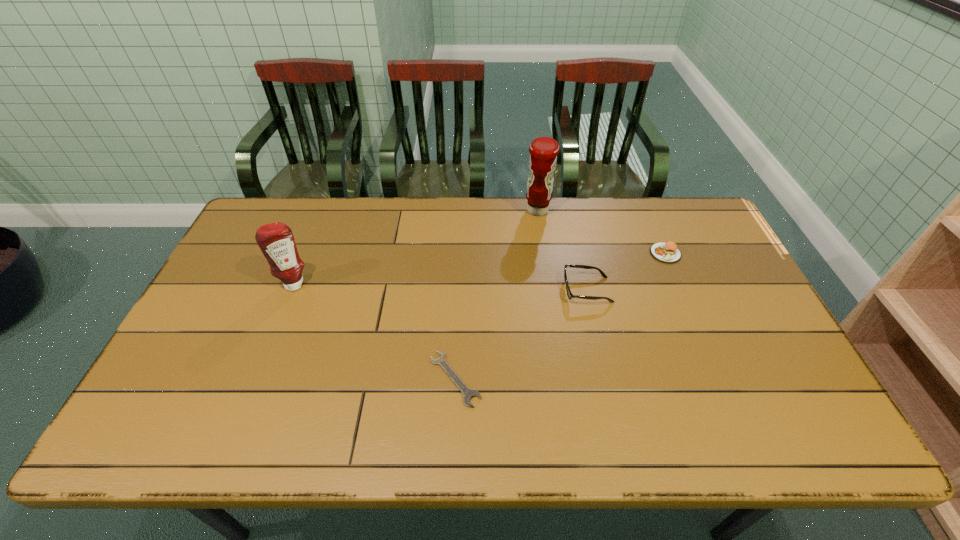
Where is `the farther condiment`? Image resolution: width=960 pixels, height=540 pixels. the farther condiment is located at coordinates (543, 151).

Where is `the tallest object`? The height and width of the screenshot is (540, 960). the tallest object is located at coordinates (543, 151).

The image size is (960, 540). In order to click on the shorter condiment in this screenshot , I will do click(x=276, y=241).

Find the location of a particular element. the nearer condiment is located at coordinates (276, 241).

Where is `spectacles`? This screenshot has height=540, width=960. spectacles is located at coordinates (569, 294).

Locate an element on the screen. This screenshot has height=540, width=960. patty is located at coordinates (668, 252).

The width and height of the screenshot is (960, 540). In order to click on the second shortest object in this screenshot , I will do `click(668, 252)`.

The width and height of the screenshot is (960, 540). What are the coordinates of `wrench` in the screenshot? It's located at (467, 393).

Where is `the nearest object`? Image resolution: width=960 pixels, height=540 pixels. the nearest object is located at coordinates (467, 393).

This screenshot has width=960, height=540. Identify the location of vacant space located 0.120m on the front of the right condiment. (542, 245).